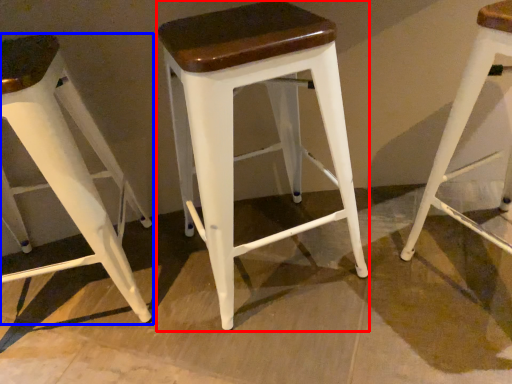
Question: Among these objects, which one is nearest to the camera, stool (highlighted by a red box) or stool (highlighted by a blue box)?

Choices:
 (A) stool
 (B) stool

Answer: (A)